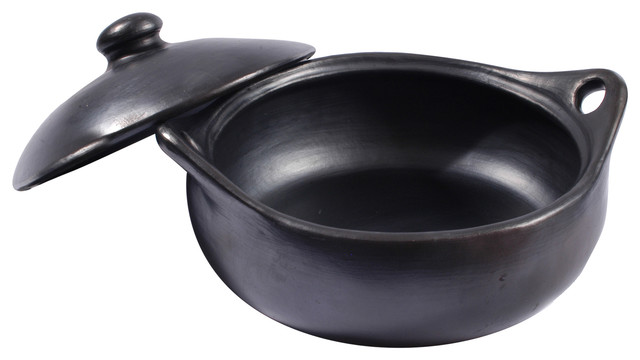
Locate an element on the screen. The width and height of the screenshot is (640, 360). black pot is located at coordinates (417, 311).